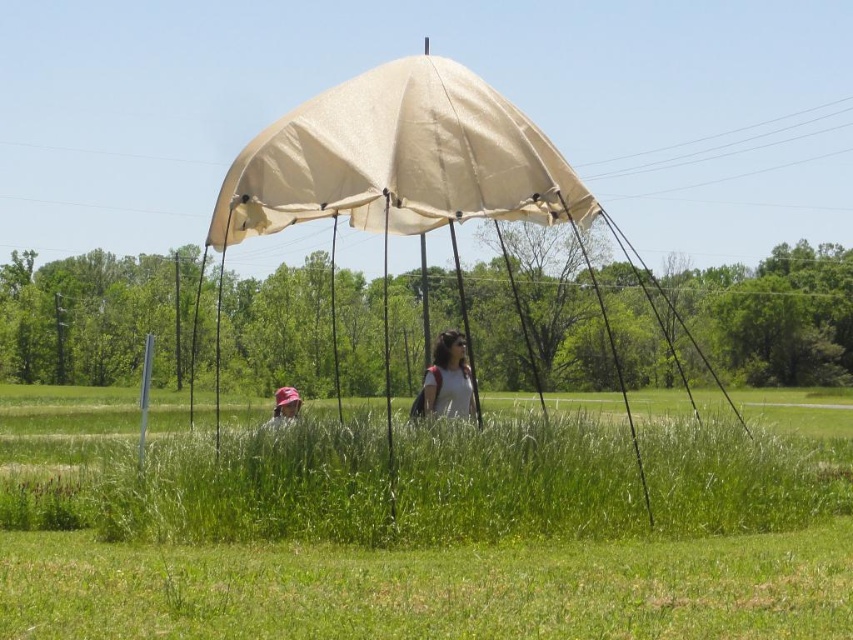
Question: Which object is positioned closest to the pink fabric hat at lower left?

Choices:
 (A) beige canvas umbrella at center
 (B) matte gray backpack at center
 (C) green grass at center
 (D) beige canvas canopy at center

Answer: (B)

Question: In this image, where is green grass at center located relative to pink fabric hat at lower left?

Choices:
 (A) right
 (B) left

Answer: (A)

Question: Can you confirm if beige canvas umbrella at center is wider than pink fabric hat at lower left?

Choices:
 (A) no
 (B) yes

Answer: (B)

Question: Among these points, which one is farthest from the camera?

Choices:
 (A) (347, 193)
 (B) (469, 570)
 (C) (462, 400)
 (D) (318, 189)

Answer: (C)

Question: Which of the following is the closest to the observer?

Choices:
 (A) (431, 138)
 (B) (363, 76)
 (C) (424, 404)

Answer: (A)

Question: Is beige canvas umbrella at center closer to camera compared to pink fabric hat at lower left?

Choices:
 (A) no
 (B) yes

Answer: (B)